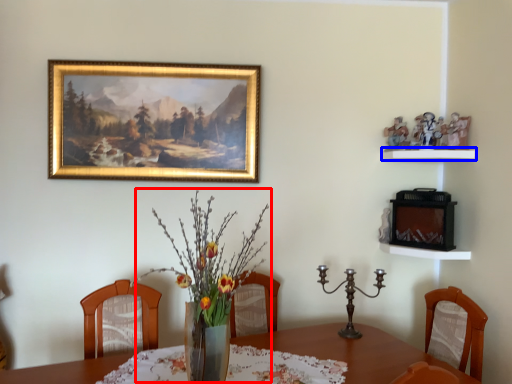
Question: Which of the following is the farthest to the observer, floral arrangement (highlighted by a red box) or shelf (highlighted by a blue box)?

Choices:
 (A) floral arrangement
 (B) shelf

Answer: (B)